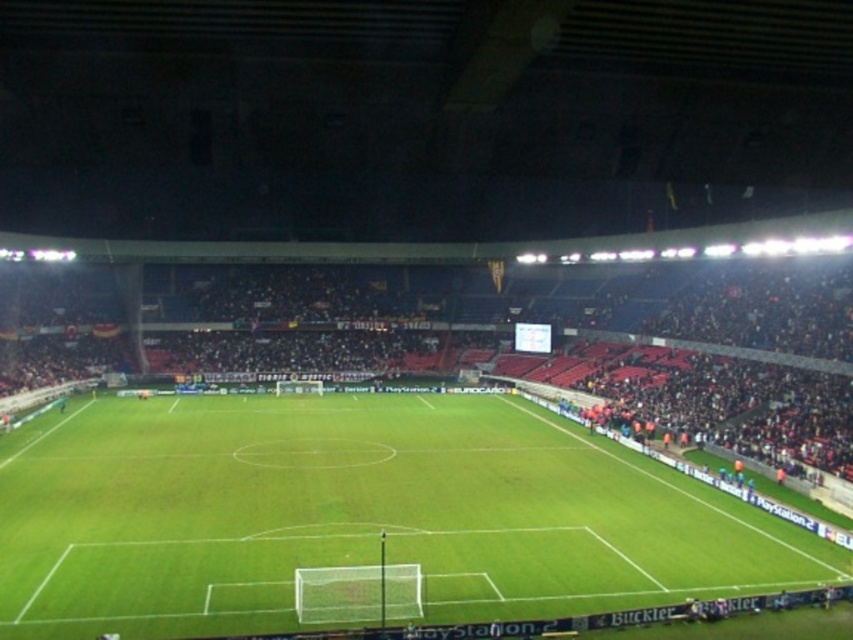
Can you confirm if green grass football field at center is bigger than dark red seats at center?

Actually, green grass football field at center might be smaller than dark red seats at center.

Between point (257, 474) and point (300, 292), which one is positioned in front?

Positioned in front is point (257, 474).

Find the location of `green grass football field at center`. green grass football field at center is located at coordinates (357, 515).